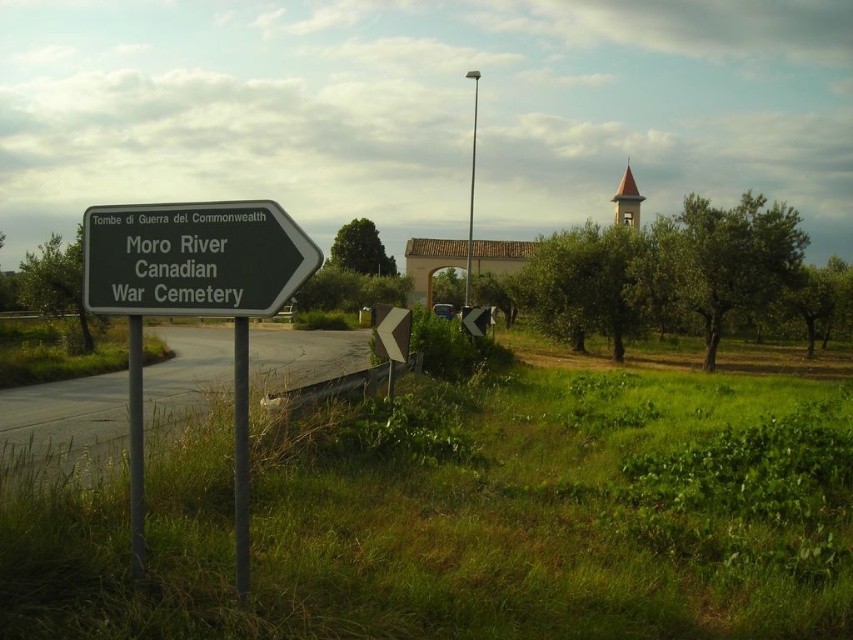
You are a tourist driving along this road and see both the green metallic sign at left and the black metal sign at left. Which sign is taller?

The green metallic sign at left is taller than the black metal sign at left.

You are a tourist holding a map and standing in front of the green metallic sign at left and the black metal sign at left. You need to choose the wider sign to get directions. Which one should you choose?

The green metallic sign at left is wider than the black metal sign at left, so you should choose the green metallic sign at left to get directions.